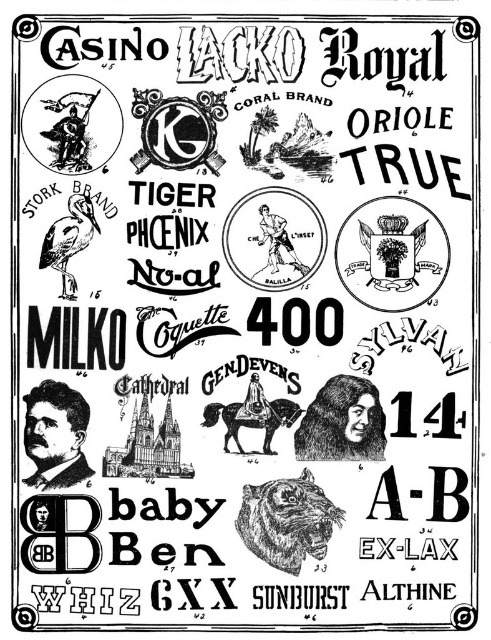
In the black and white illustration, there is a black ink drawing of a person at center and a brown leather horse at center. Based on their positions, which object is located to the right?

The black ink drawing of a person at center is to the right of the brown leather horse at center.

You are standing in front of the image and notice two points labeled as point 1 at coordinates (276, 524) and point 2 at (241, 445). Which point is closer to you?

Point 1 at coordinates (276, 524) is closer to you because it is closer to the camera than point 2 at (241, 445).